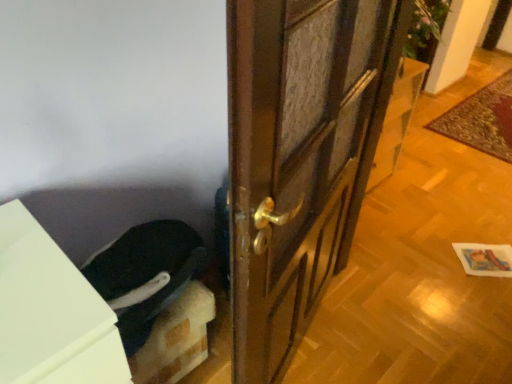
Question: Can you confirm if brown wooden door at center is positioned to the right of dark blue fabric at lower left?

Choices:
 (A) no
 (B) yes

Answer: (B)

Question: From the image's perspective, is brown wooden door at center located above dark blue fabric at lower left?

Choices:
 (A) no
 (B) yes

Answer: (B)

Question: From a real-world perspective, is brown wooden door at center beneath dark blue fabric at lower left?

Choices:
 (A) yes
 (B) no

Answer: (A)

Question: Is brown wooden door at center positioned far away from dark blue fabric at lower left?

Choices:
 (A) no
 (B) yes

Answer: (A)

Question: Does brown wooden door at center turn towards dark blue fabric at lower left?

Choices:
 (A) no
 (B) yes

Answer: (A)

Question: Based on their positions, is white matte cabinet at lower left located to the left or right of brown wooden door at center?

Choices:
 (A) right
 (B) left

Answer: (B)

Question: In the image, is white matte cabinet at lower left positioned in front of or behind brown wooden door at center?

Choices:
 (A) front
 (B) behind

Answer: (A)

Question: From a real-world perspective, relative to brown wooden door at center, is white matte cabinet at lower left vertically above or below?

Choices:
 (A) below
 (B) above

Answer: (B)

Question: From the image's perspective, is white matte cabinet at lower left located above or below brown wooden door at center?

Choices:
 (A) below
 (B) above

Answer: (A)

Question: Considering the relative positions of brown wooden door at center and carpeted mat at right in the image provided, is brown wooden door at center to the left or to the right of carpeted mat at right?

Choices:
 (A) left
 (B) right

Answer: (A)

Question: From the image's perspective, is brown wooden door at center located above or below carpeted mat at right?

Choices:
 (A) below
 (B) above

Answer: (A)

Question: Do you think brown wooden door at center is within carpeted mat at right, or outside of it?

Choices:
 (A) inside
 (B) outside

Answer: (B)

Question: Is brown wooden door at center in front of or behind carpeted mat at right in the image?

Choices:
 (A) behind
 (B) front

Answer: (B)

Question: Is point (38, 349) positioned closer to the camera than point (180, 225)?

Choices:
 (A) closer
 (B) farther

Answer: (A)

Question: Is white matte cabinet at lower left bigger or smaller than dark blue fabric at lower left?

Choices:
 (A) big
 (B) small

Answer: (A)